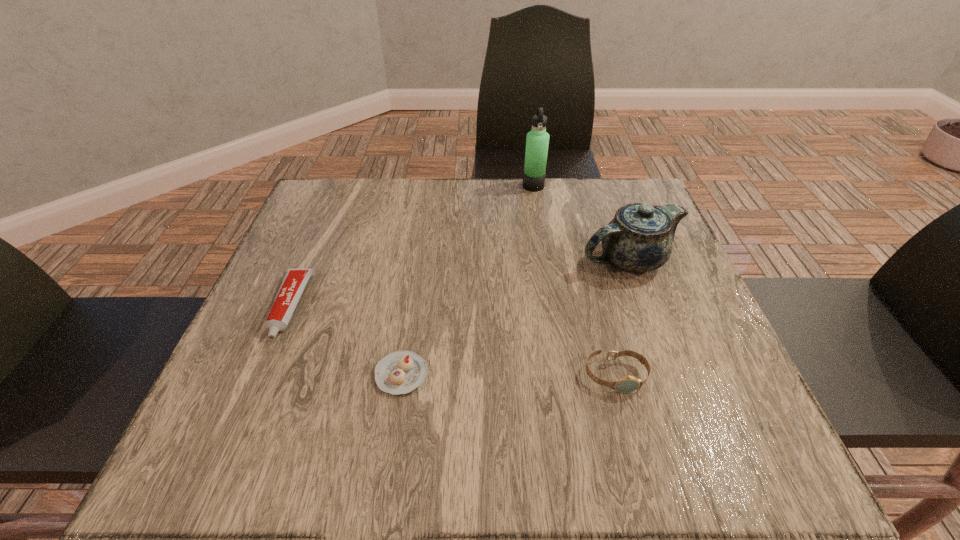
Find the location of a particular element. The height and width of the screenshot is (540, 960). free space between the cupcake and the farthest object is located at coordinates (468, 280).

Where is `free point between the tallest object and the leftmost object`? free point between the tallest object and the leftmost object is located at coordinates (412, 246).

This screenshot has width=960, height=540. I want to click on unoccupied area between the watch and the second object from left to right, so click(509, 375).

Locate an element on the screen. Image resolution: width=960 pixels, height=540 pixels. object that is the closest one to the second tallest object is located at coordinates (626, 384).

This screenshot has width=960, height=540. I want to click on object that is the fourth nearest to the cupcake, so click(x=537, y=141).

Where is `free space that satisfies the following two spatial constraints: 1. at the nozzle of the cupcake; 2. on the left side of the leftmost object`? The width and height of the screenshot is (960, 540). free space that satisfies the following two spatial constraints: 1. at the nozzle of the cupcake; 2. on the left side of the leftmost object is located at coordinates (261, 374).